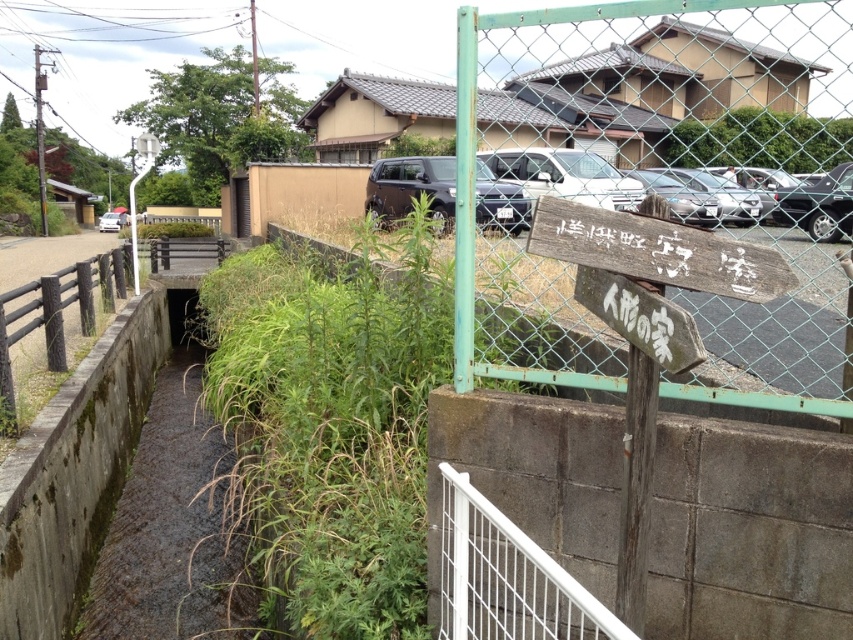
Does white metal rail at lower center appear on the right side of satin black suv at center?

Correct, you'll find white metal rail at lower center to the right of satin black suv at center.

The height and width of the screenshot is (640, 853). What do you see at coordinates (506, 577) in the screenshot? I see `white metal rail at lower center` at bounding box center [506, 577].

Where is `white metal rail at lower center`? white metal rail at lower center is located at coordinates (506, 577).

Can you confirm if satin black suv at center is thinner than matte black suv at center?

Yes, satin black suv at center is thinner than matte black suv at center.

Find the location of a particular element. This screenshot has width=853, height=640. satin black suv at center is located at coordinates (410, 188).

Does point (503, 188) come in front of point (112, 216)?

Yes.

This screenshot has width=853, height=640. I want to click on satin black suv at center, so click(x=410, y=188).

Who is higher up, brown wooden rail at left or matte black suv at center?

matte black suv at center

Does brown wooden rail at left appear under matte black suv at center?

Yes, brown wooden rail at left is below matte black suv at center.

You are a GUI agent. You are given a task and a screenshot of the screen. Output one action in this format:
    pyautogui.click(x=<x>, y=<y>)
    Task: Click on the brown wooden rail at left
    This screenshot has height=640, width=853.
    Given the screenshot: What is the action you would take?
    pyautogui.click(x=57, y=316)